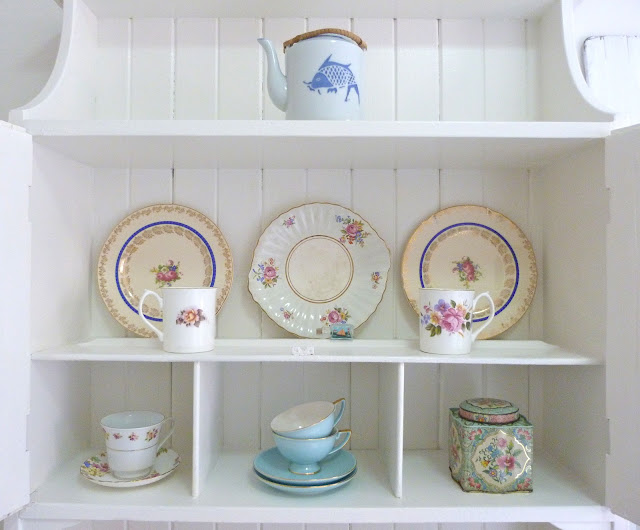
You are a GUI agent. You are given a task and a screenshot of the screen. Output one action in this format:
    pyautogui.click(x=<x>, y=<y>)
    Task: Click on the shelve barriers
    This screenshot has width=640, height=530.
    Given the screenshot: What is the action you would take?
    pyautogui.click(x=208, y=422), pyautogui.click(x=395, y=428)